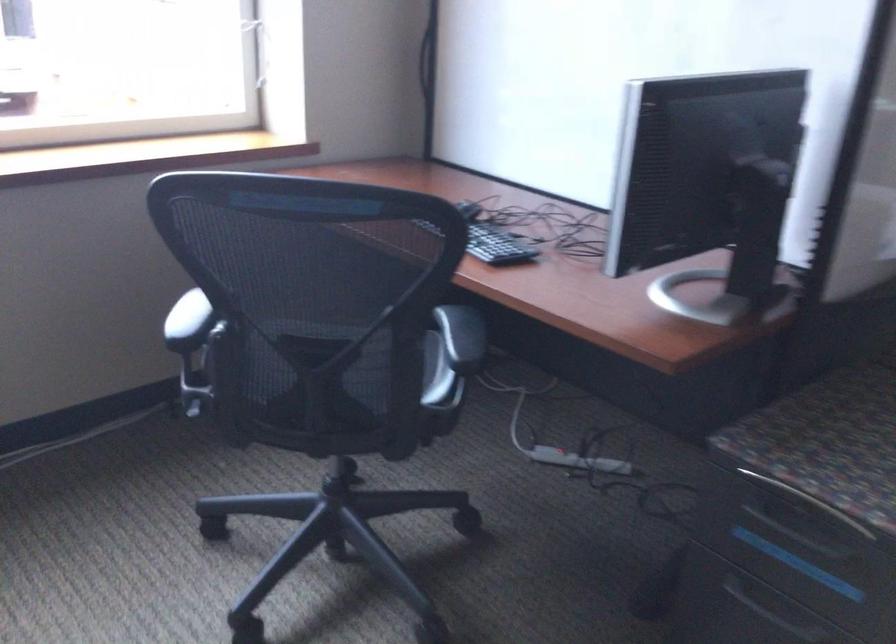
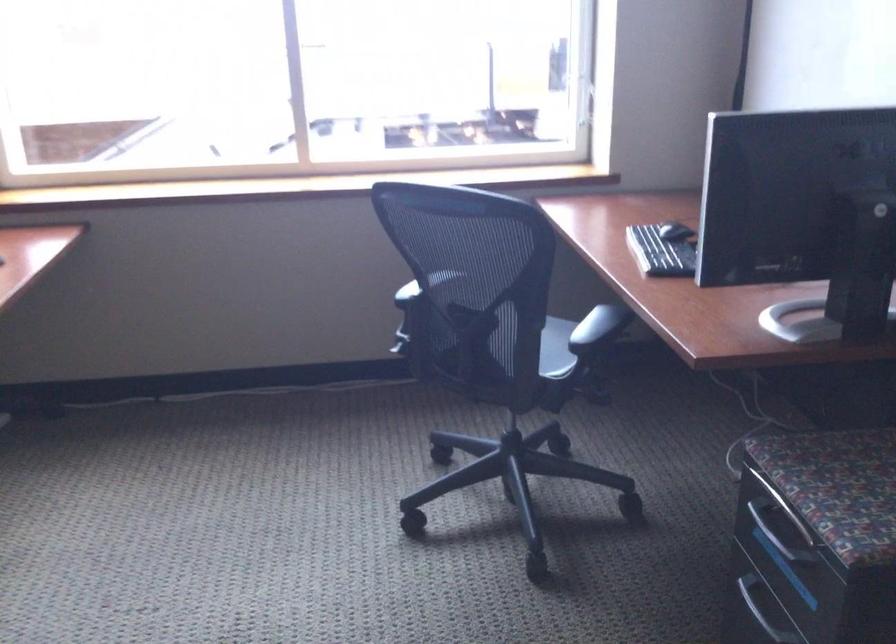
The point at [779,527] is marked in the first image. Where is the corresponding point in the second image?

(776, 532)